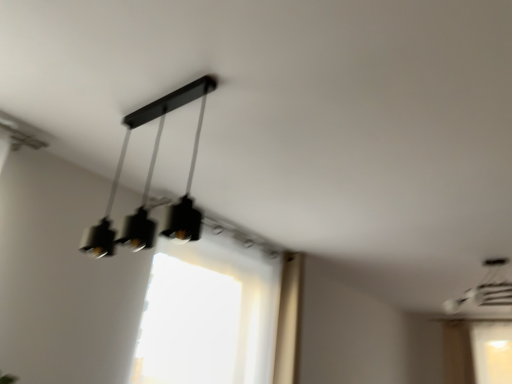
Question: Is transparent fabric window at center at the left side of matte black pendant light at upper center, acting as the 1th lamp starting from the front?

Choices:
 (A) yes
 (B) no

Answer: (B)

Question: Is transparent fabric window at center positioned in front of matte black pendant light at upper center, the 2th lamp in the bottom-to-top sequence?

Choices:
 (A) yes
 (B) no

Answer: (B)

Question: Could you tell me if transparent fabric window at center is facing matte black pendant light at upper center, which is counted as the first lamp, starting from the top?

Choices:
 (A) yes
 (B) no

Answer: (B)

Question: Does transparent fabric window at center have a lesser height compared to matte black pendant light at upper center, which is counted as the first lamp, starting from the top?

Choices:
 (A) yes
 (B) no

Answer: (B)

Question: Considering the relative sizes of transparent fabric window at center and matte black pendant light at upper center, which is the 2th lamp in back-to-front order, in the image provided, is transparent fabric window at center smaller than matte black pendant light at upper center, which is the 2th lamp in back-to-front order,?

Choices:
 (A) no
 (B) yes

Answer: (A)

Question: From the image's perspective, would you say transparent fabric window at center is shown under matte black pendant light at upper center, acting as the 1th lamp starting from the front?

Choices:
 (A) yes
 (B) no

Answer: (A)

Question: From the image's perspective, is transparent fabric window at center beneath matte black chandelier at upper right, which is the second lamp from left to right?

Choices:
 (A) yes
 (B) no

Answer: (A)

Question: Is transparent fabric window at center further to camera compared to matte black chandelier at upper right, the 2th lamp in the front-to-back sequence?

Choices:
 (A) yes
 (B) no

Answer: (B)

Question: From a real-world perspective, is transparent fabric window at center physically below matte black chandelier at upper right, which is counted as the first lamp, starting from the bottom?

Choices:
 (A) no
 (B) yes

Answer: (B)

Question: Considering the relative sizes of transparent fabric window at center and matte black chandelier at upper right, the 2th lamp in the front-to-back sequence, in the image provided, is transparent fabric window at center bigger than matte black chandelier at upper right, the 2th lamp in the front-to-back sequence,?

Choices:
 (A) yes
 (B) no

Answer: (A)

Question: Can you confirm if transparent fabric window at center is positioned to the left of matte black chandelier at upper right, the first lamp when ordered from back to front?

Choices:
 (A) yes
 (B) no

Answer: (A)

Question: Can you confirm if transparent fabric window at center is shorter than matte black chandelier at upper right, marked as the second lamp in a top-to-bottom arrangement?

Choices:
 (A) no
 (B) yes

Answer: (A)

Question: Can you confirm if matte black pendant light at upper center, which is counted as the first lamp, starting from the top, is shorter than transparent fabric window at center?

Choices:
 (A) yes
 (B) no

Answer: (A)